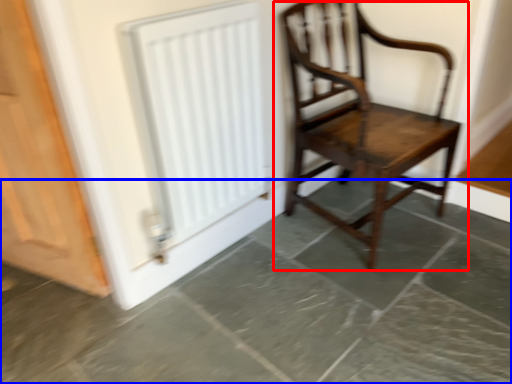
Question: Among these objects, which one is farthest to the camera, chair (highlighted by a red box) or concrete (highlighted by a blue box)?

Choices:
 (A) chair
 (B) concrete

Answer: (A)